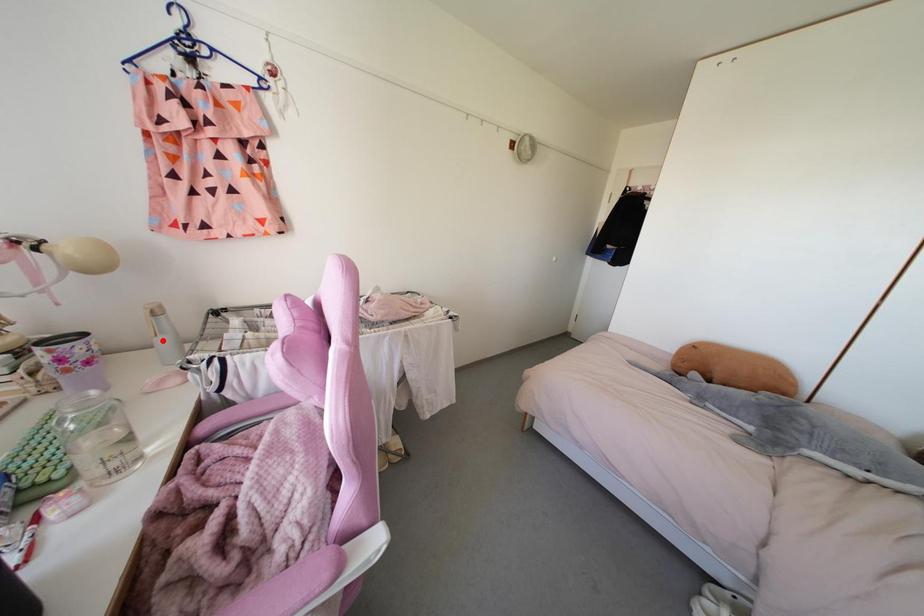
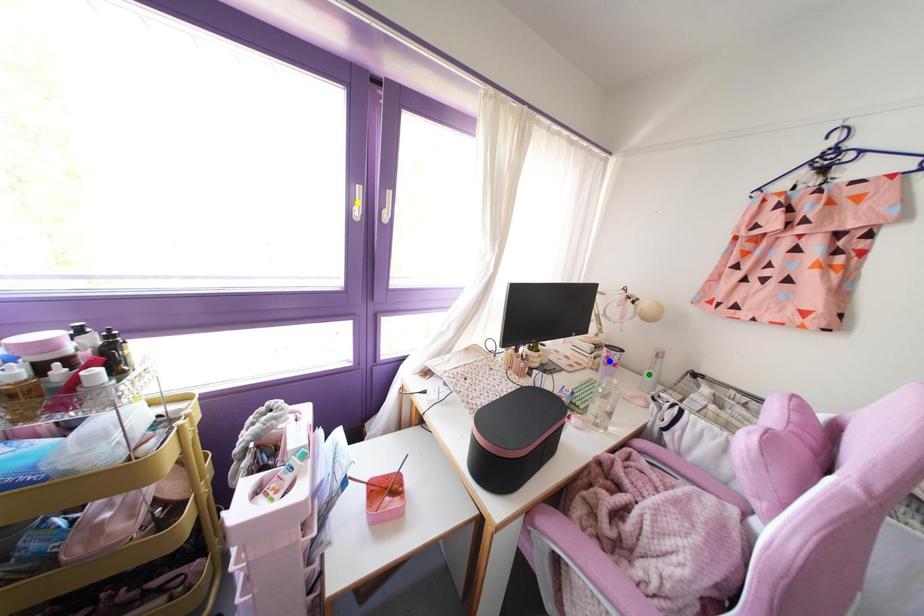
Question: I am providing you with two images of the same scene from different viewpoints. A red point is marked on the first image. You are given multiple points on the second image. In image 2, which mark is for the same physical point as the one in image 1?

Choices:
 (A) yellow point
 (B) green point
 (C) blue point

Answer: (B)